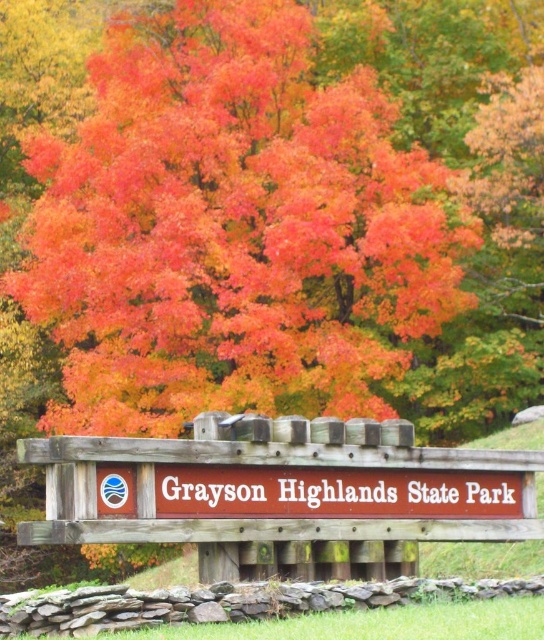
Who is higher up, vivid orange leaves at center or brown wooden sign at center?

vivid orange leaves at center is higher up.

Is point (220, 70) positioned before point (207, 518)?

No, (220, 70) is behind (207, 518).

Is point (141, 150) positioned in front of point (84, 480)?

No, it is behind (84, 480).

Locate an element on the screen. The height and width of the screenshot is (640, 544). vivid orange leaves at center is located at coordinates (232, 228).